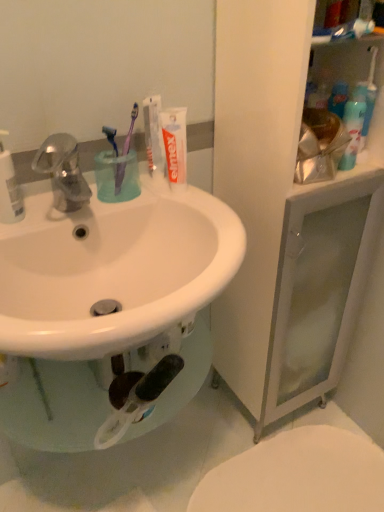
Question: Which direction should I rotate to look at purple plastic toothbrush at upper center, the 1th toothbrush positioned from the right, — up or down?

Choices:
 (A) down
 (B) up

Answer: (B)

Question: From the image's perspective, is white matte toothpaste at upper center, positioned as the second toothpaste in right-to-left order, on purple plastic toothbrush at upper center, the 1th toothbrush positioned from the right?

Choices:
 (A) yes
 (B) no

Answer: (A)

Question: Is there a large distance between white matte toothpaste at upper center, which appears as the first toothpaste when viewed from the left, and purple plastic toothbrush at upper center, the 1th toothbrush positioned from the right?

Choices:
 (A) no
 (B) yes

Answer: (A)

Question: From the image's perspective, is white matte toothpaste at upper center, which appears as the first toothpaste when viewed from the left, under purple plastic toothbrush at upper center, which is the 2th toothbrush in left-to-right order?

Choices:
 (A) yes
 (B) no

Answer: (B)

Question: Is white matte toothpaste at upper center, which appears as the first toothpaste when viewed from the left, positioned beyond the bounds of purple plastic toothbrush at upper center, which is the 2th toothbrush in left-to-right order?

Choices:
 (A) no
 (B) yes

Answer: (B)

Question: Can you confirm if white matte toothpaste at upper center, which appears as the first toothpaste when viewed from the left, is positioned to the right of purple plastic toothbrush at upper center, the 1th toothbrush positioned from the right?

Choices:
 (A) yes
 (B) no

Answer: (A)

Question: Can you confirm if white matte toothpaste at upper center, which appears as the first toothpaste when viewed from the left, is wider than purple plastic toothbrush at upper center, which is the 2th toothbrush in left-to-right order?

Choices:
 (A) yes
 (B) no

Answer: (B)

Question: Is purple plastic toothbrush at upper center, the 1th toothbrush positioned from the right, turned away from white matte toothpaste at upper center, positioned as the second toothpaste in right-to-left order?

Choices:
 (A) yes
 (B) no

Answer: (B)

Question: Considering the relative sizes of purple plastic toothbrush at upper center, which is the 2th toothbrush in left-to-right order, and white matte toothpaste at upper center, which appears as the first toothpaste when viewed from the left, in the image provided, is purple plastic toothbrush at upper center, which is the 2th toothbrush in left-to-right order, smaller than white matte toothpaste at upper center, which appears as the first toothpaste when viewed from the left,?

Choices:
 (A) no
 (B) yes

Answer: (A)

Question: Is purple plastic toothbrush at upper center, the 1th toothbrush positioned from the right, thinner than white matte toothpaste at upper center, positioned as the second toothpaste in right-to-left order?

Choices:
 (A) yes
 (B) no

Answer: (B)

Question: Does purple plastic toothbrush at upper center, which is the 2th toothbrush in left-to-right order, have a larger size compared to white matte toothpaste at upper center, positioned as the second toothpaste in right-to-left order?

Choices:
 (A) yes
 (B) no

Answer: (A)

Question: Can you confirm if purple plastic toothbrush at upper center, which is the 2th toothbrush in left-to-right order, is wider than white matte toothpaste at upper center, positioned as the second toothpaste in right-to-left order?

Choices:
 (A) no
 (B) yes

Answer: (B)

Question: Is the position of purple plastic toothbrush at upper center, which is the 2th toothbrush in left-to-right order, less distant than that of white matte toothpaste at upper center, positioned as the second toothpaste in right-to-left order?

Choices:
 (A) no
 (B) yes

Answer: (B)

Question: Is white matte toothpaste at upper center, which appears as the first toothpaste when viewed from the left, thinner than purple plastic toothbrush at upper center, which ranks as the second toothbrush in right-to-left order?

Choices:
 (A) no
 (B) yes

Answer: (B)